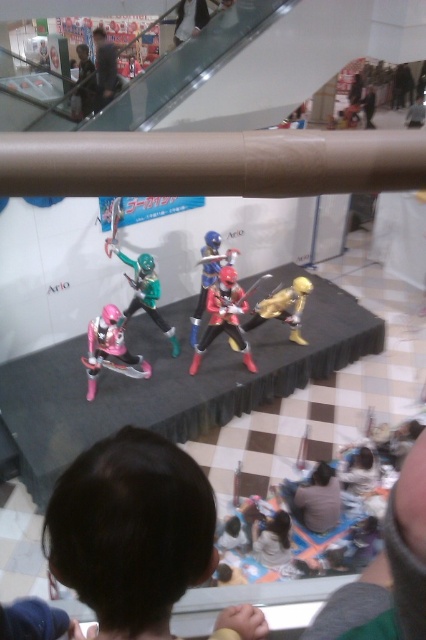
You are a customer at the mall looking to place a small keychain in your bag. You see the matte green plastic toy at upper center and the light brown leather shoes at upper center. Which object is closer to the left side of the display?

The matte green plastic toy at upper center is positioned on the left side of light brown leather shoes at upper center, so it is closer to the left side of the display.

You are standing in front of the superhero action figure display at the shopping mall. You notice a dark brown hair at lower center. Where exactly is the dark brown hair located in terms of coordinates?

The dark brown hair at lower center is located at point coordinates of (x=132, y=531).

You are standing in front of the display of superhero action figures at the shopping mall. You want to reach a point that is exactly 57.00 centimeters away from your current position. Can you determine if the point at coordinates (x=77, y=483) will be within your reach?

The point at coordinates (x=77, y=483) is 57.00 centimeters from the camera, so yes, it will be within your reach since it matches the desired distance.